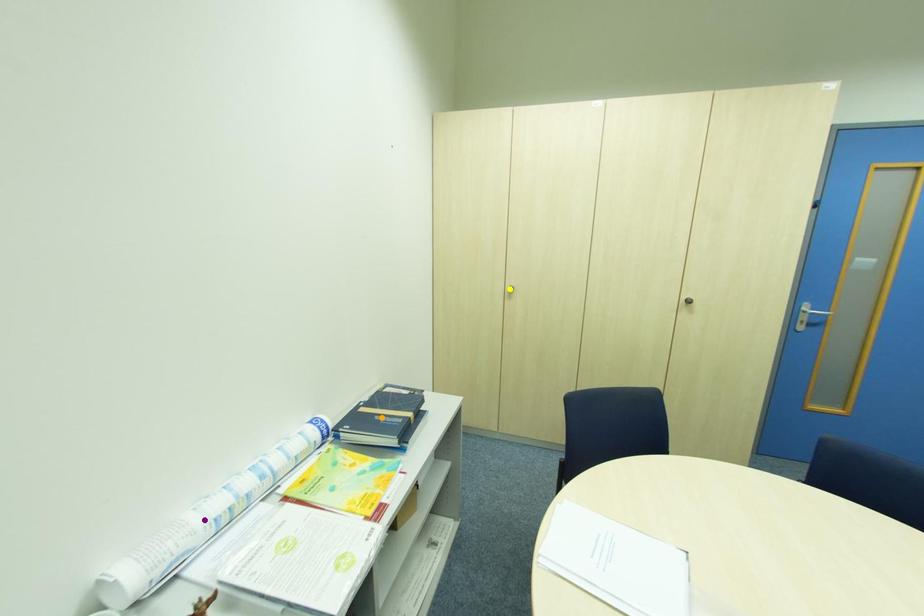
Order these from nearest to farthest:
yellow point
orange point
purple point

purple point, orange point, yellow point